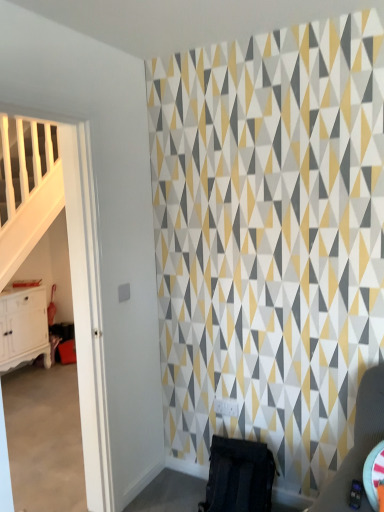
Identify the location of vacant space to the right of white glossy cabinet at left. (49, 382).